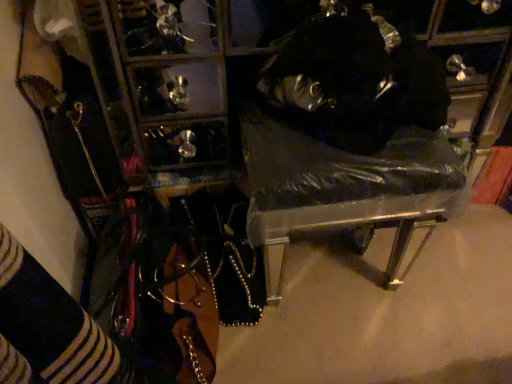
Locate an element on the screen. The height and width of the screenshot is (384, 512). blank space situated above clear plastic bag at center (from a real-world perspective) is located at coordinates (341, 140).